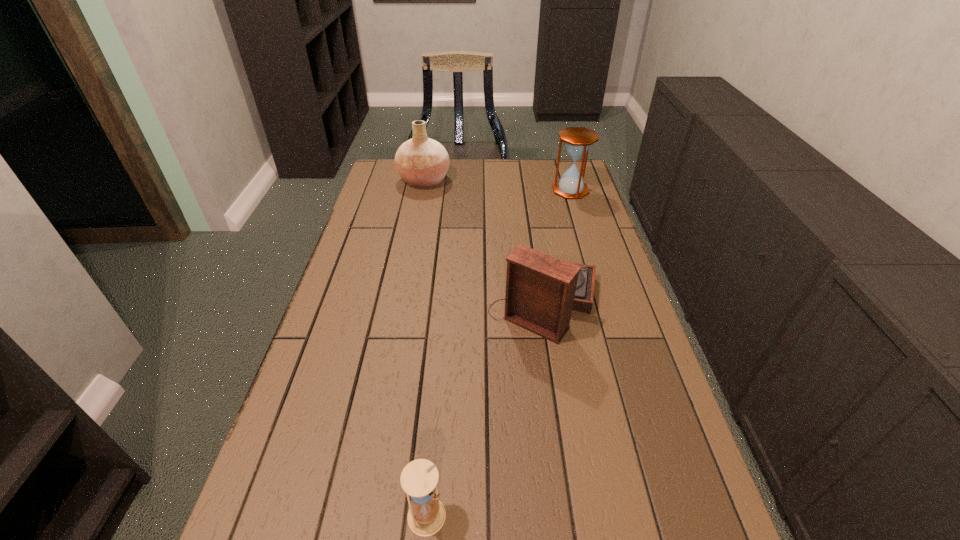
Where is `pottery`? Image resolution: width=960 pixels, height=540 pixels. pottery is located at coordinates click(x=422, y=162).

Find the location of a particular element. Image resolution: width=960 pixels, height=540 pixels. the taller hourglass is located at coordinates (577, 140).

The height and width of the screenshot is (540, 960). In order to click on the farther hourglass in this screenshot , I will do `click(577, 140)`.

Where is `the second nearest object`? The width and height of the screenshot is (960, 540). the second nearest object is located at coordinates (541, 291).

At what (x,y) coordinates should I click in order to perform the action: click on the shorter hourglass. Please return your answer as a coordinate pair (x, y). Looking at the image, I should click on (426, 516).

Locate an element on the screen. The height and width of the screenshot is (540, 960). the nearest object is located at coordinates (426, 516).

The width and height of the screenshot is (960, 540). What are the coordinates of `free spot located 0.100m to pour from the handle of the pottery` in the screenshot? It's located at (477, 180).

Find the location of `vacant space located on the front of the farther hourglass`. vacant space located on the front of the farther hourglass is located at coordinates click(586, 241).

You are a GUI agent. You are given a task and a screenshot of the screen. Output one action in this format:
    pyautogui.click(x=<x>, y=<y>)
    Task: Click on the blank space located 0.290m on the back of the phonograph record
    This screenshot has width=960, height=540.
    Given the screenshot: What is the action you would take?
    coord(530,212)

At what (x,y) coordinates should I click in order to perform the action: click on free spot located on the left of the shortest object. Please return your answer as a coordinate pair (x, y). Looking at the image, I should click on (257, 516).